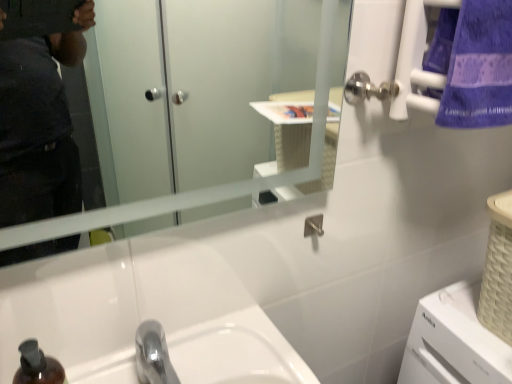
Question: Is chrome metallic sink at center taller than clear glass mirror at upper center?

Choices:
 (A) no
 (B) yes

Answer: (A)

Question: From a real-world perspective, is chrome metallic sink at center below clear glass mirror at upper center?

Choices:
 (A) yes
 (B) no

Answer: (A)

Question: Is chrome metallic sink at center surrounding clear glass mirror at upper center?

Choices:
 (A) yes
 (B) no

Answer: (B)

Question: From the image's perspective, is chrome metallic sink at center located above clear glass mirror at upper center?

Choices:
 (A) no
 (B) yes

Answer: (A)

Question: From a real-world perspective, is chrome metallic sink at center on clear glass mirror at upper center?

Choices:
 (A) yes
 (B) no

Answer: (B)

Question: Visually, is clear glass mirror at upper center positioned to the left or to the right of chrome metallic sink at center?

Choices:
 (A) left
 (B) right

Answer: (B)

Question: Considering the positions of clear glass mirror at upper center and chrome metallic sink at center in the image, is clear glass mirror at upper center taller or shorter than chrome metallic sink at center?

Choices:
 (A) tall
 (B) short

Answer: (A)

Question: Is clear glass mirror at upper center wider or thinner than chrome metallic sink at center?

Choices:
 (A) wide
 (B) thin

Answer: (B)

Question: In terms of size, does clear glass mirror at upper center appear bigger or smaller than chrome metallic sink at center?

Choices:
 (A) small
 (B) big

Answer: (A)

Question: In the image, is chrome metallic sink at center positioned in front of or behind purple cotton towel at upper right?

Choices:
 (A) front
 (B) behind

Answer: (A)

Question: Is chrome metallic sink at center spatially inside purple cotton towel at upper right, or outside of it?

Choices:
 (A) outside
 (B) inside

Answer: (A)

Question: Is point (293, 354) closer or farther from the camera than point (458, 54)?

Choices:
 (A) farther
 (B) closer

Answer: (A)

Question: Is chrome metallic sink at center bigger or smaller than purple cotton towel at upper right?

Choices:
 (A) small
 (B) big

Answer: (B)

Question: In terms of size, does clear glass mirror at upper center appear bigger or smaller than purple cotton towel at upper right?

Choices:
 (A) big
 (B) small

Answer: (A)

Question: From a real-world perspective, relative to purple cotton towel at upper right, is clear glass mirror at upper center vertically above or below?

Choices:
 (A) above
 (B) below

Answer: (B)